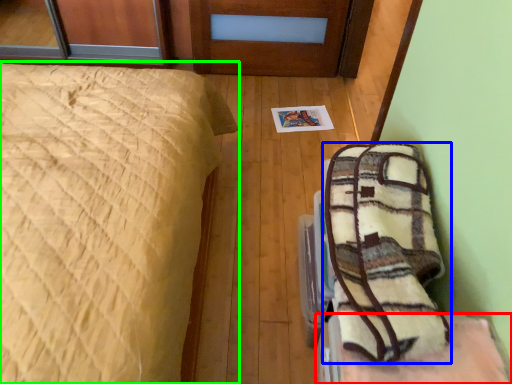
Question: Based on their relative distances, which object is nearer to furniture (highlighted by a red box)? Choose from blanket (highlighted by a blue box) and bed (highlighted by a green box).

Choices:
 (A) blanket
 (B) bed

Answer: (A)